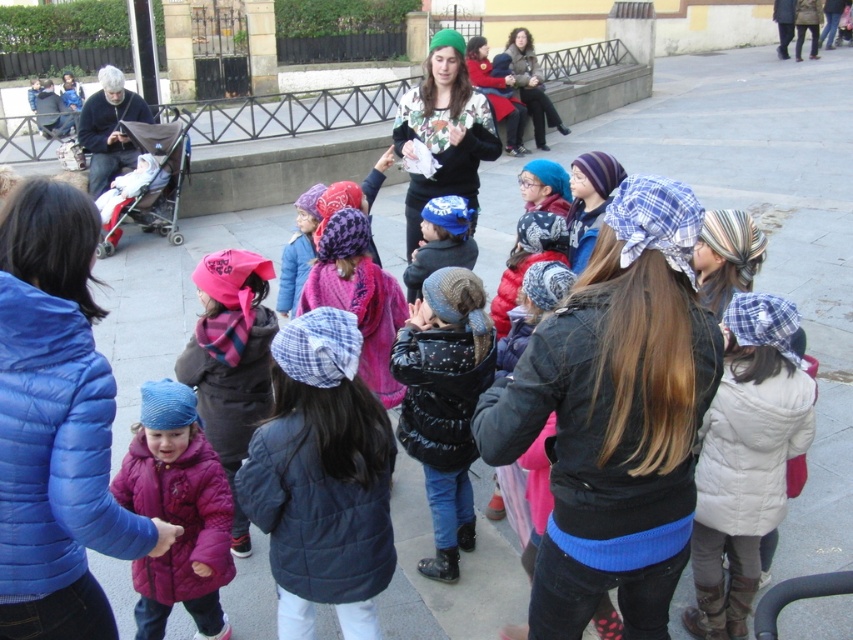
In the scene described, there are two children wearing a matte pink coat at center and a matte black jacket at left. From the perspective of an observer standing in front of the group, which child is positioned more to the right?

The matte pink coat at center is positioned to the right of the matte black jacket at left, so the child in the matte pink coat at center is more to the right.

You are a photographer trying to capture a group photo of the children in the scene. You notice two jackets, the black puffy jacket at center and the matte black jacket at left. Which jacket should you focus on if you want to include both in the frame without cropping either?

The black puffy jacket at center is smaller in size compared to the matte black jacket at left. To include both without cropping, focus on the matte black jacket at left since it is larger and will be easier to frame alongside the smaller one.